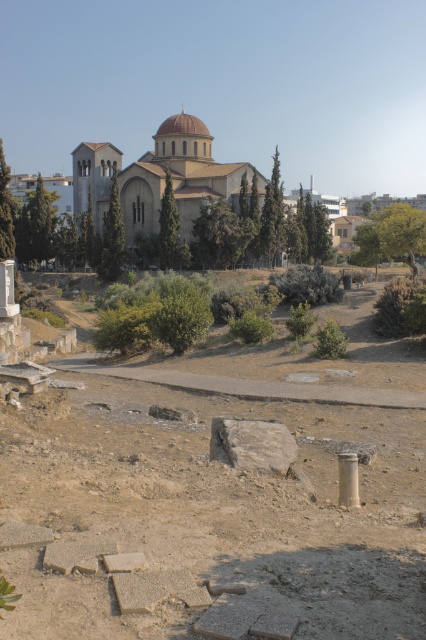
You are an archaeologist standing near the silver metallic pillar at lower right, and you want to examine the brown stone ruins at center. Which direction should you move to reach the ruins?

You should move towards the center from the silver metallic pillar at lower right to reach the brown stone ruins at center.

You are an archaeologist standing at the base of the silver metallic pillar at lower right. You want to reach the brown stone ruins at center to examine them. Is there a direct path upwards from the pillar to the ruins?

The brown stone ruins at center is above the silver metallic pillar at lower right, so there is a direct upward path from the pillar to the ruins.